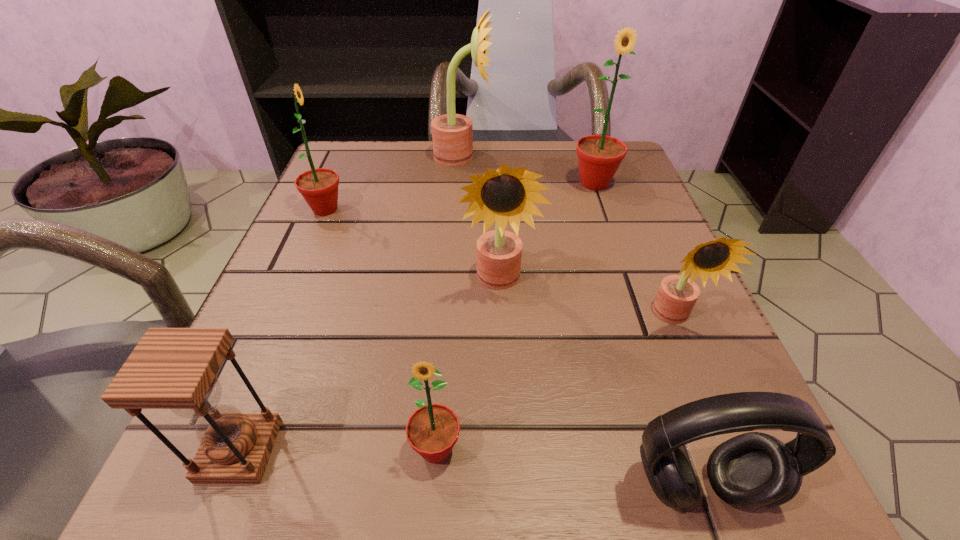
I want to click on sunflower that is positioned at the left edge, so click(319, 187).

At what (x,y) coordinates should I click in order to perform the action: click on hourglass that is at the left edge. Please return your answer as a coordinate pair (x, y). Looking at the image, I should click on (170, 368).

Locate an element on the screen. headset that is at the right edge is located at coordinates (753, 470).

The image size is (960, 540). I want to click on object that is at the far left corner, so click(x=319, y=187).

Locate an element on the screen. This screenshot has width=960, height=540. object at the near left corner is located at coordinates (170, 368).

Where is `object at the far right corner`? This screenshot has height=540, width=960. object at the far right corner is located at coordinates (599, 156).

This screenshot has width=960, height=540. In order to click on object present at the near right corner in this screenshot , I will do `click(753, 470)`.

This screenshot has width=960, height=540. In the image, there is a desktop. In order to click on vacant space at the far edge in this screenshot , I will do `click(494, 156)`.

Identify the location of vacant region at the near edge of the desktop. This screenshot has height=540, width=960. (367, 472).

The width and height of the screenshot is (960, 540). In order to click on free space at the left edge in this screenshot , I will do `click(332, 249)`.